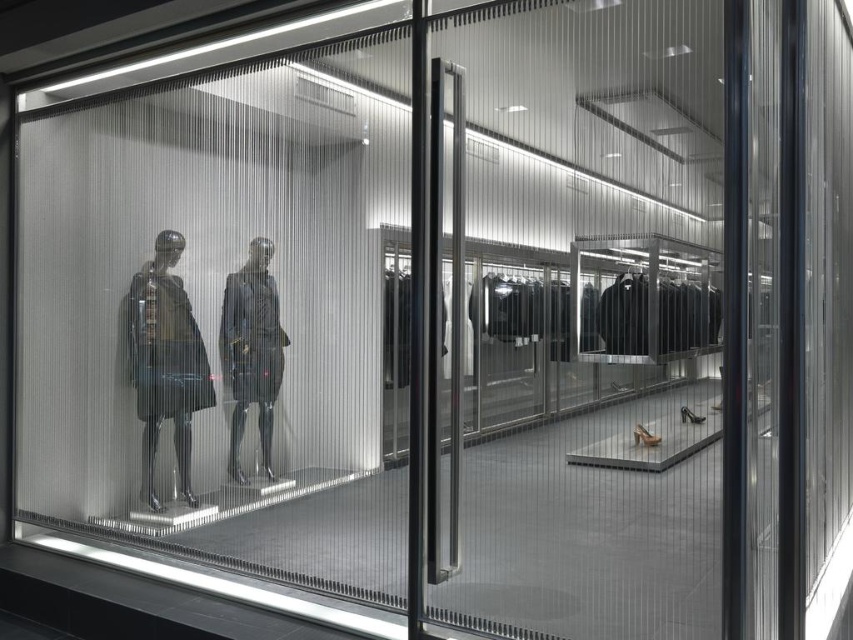
Question: Which object is closer to the camera taking this photo?

Choices:
 (A) transparent plastic door at center
 (B) transparent plastic mannequins at left
 (C) matte black suit at center

Answer: (A)

Question: Which object is farther from the camera taking this photo?

Choices:
 (A) matte black suit at center
 (B) transparent plastic door at center
 (C) matte black dress at left

Answer: (C)

Question: Is transparent plastic mannequins at left closer to the viewer compared to matte black suit at center?

Choices:
 (A) yes
 (B) no

Answer: (A)

Question: Considering the real-world distances, which object is closest to the matte black dress at left?

Choices:
 (A) transparent plastic mannequins at left
 (B) transparent plastic door at center

Answer: (A)

Question: Is matte black dress at left above matte black suit at center?

Choices:
 (A) yes
 (B) no

Answer: (B)

Question: Is transparent plastic mannequins at left smaller than matte black dress at left?

Choices:
 (A) no
 (B) yes

Answer: (A)